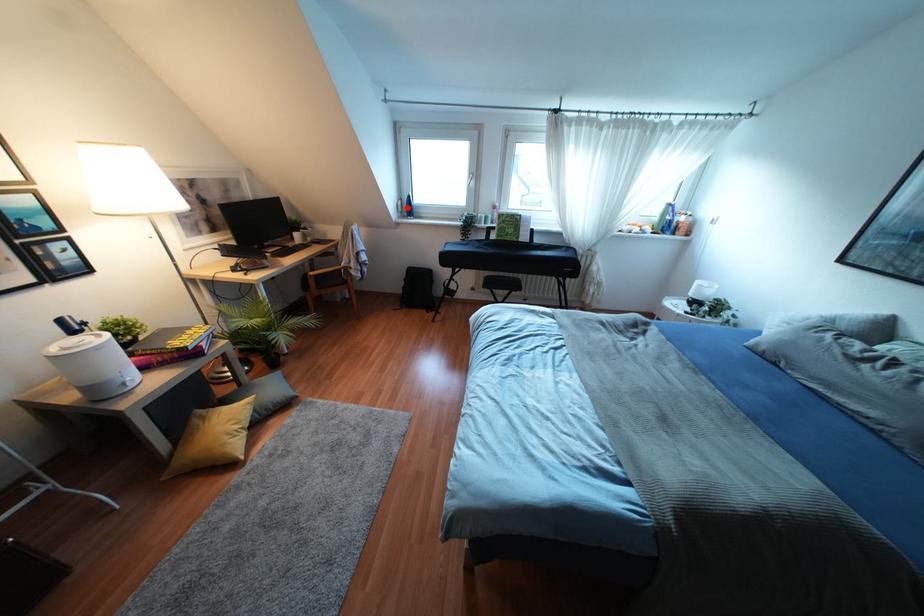
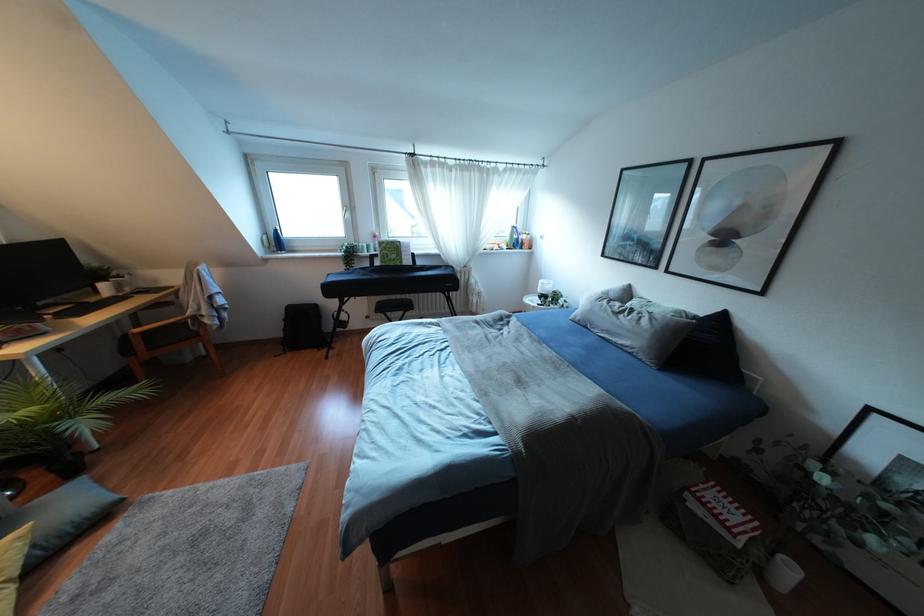
Where in the second image is the point corresponding to the highlighted location from the first image?

(275, 241)